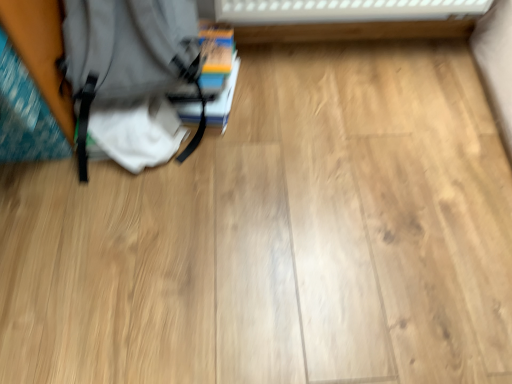
Identify the location of vacant area that is situated to the right of hardcover book at center-left. Image resolution: width=512 pixels, height=384 pixels. (293, 96).